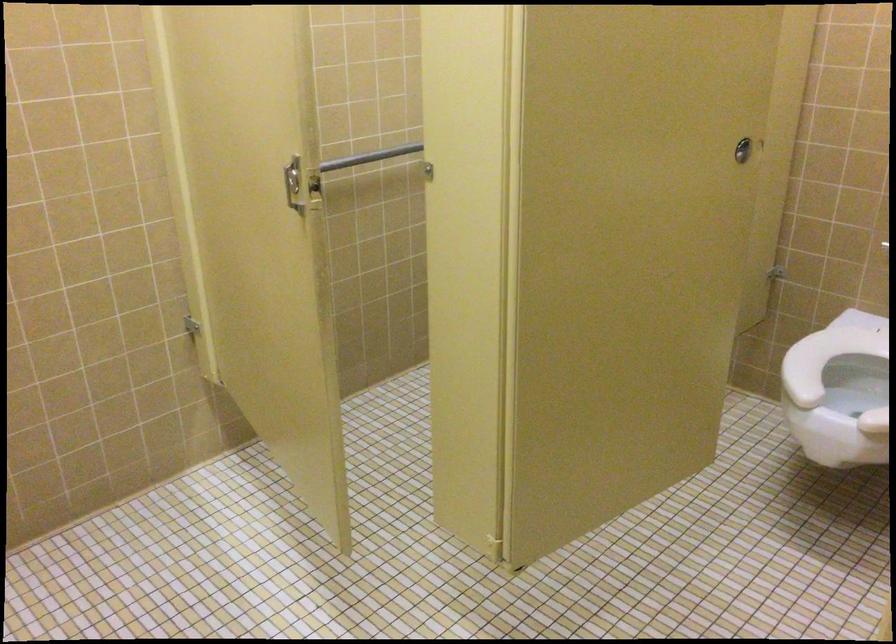
Where would you turn the silver door lock? Please return your answer as a coordinate pair (x, y).

(293, 184)